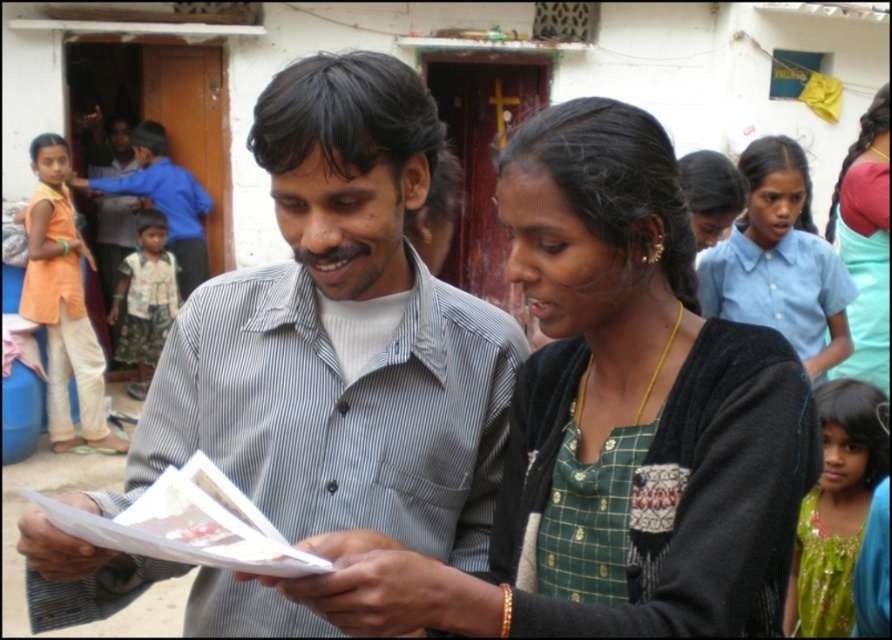
Question: Is striped cotton shirt at center smaller than teal fabric dress at upper right?

Choices:
 (A) yes
 (B) no

Answer: (A)

Question: Is green embroidered dress at lower right bigger than teal fabric dress at upper right?

Choices:
 (A) no
 (B) yes

Answer: (A)

Question: Which of these objects is positioned closest to the green embroidered dress at lower right?

Choices:
 (A) teal fabric dress at upper right
 (B) green woven apron at lower right

Answer: (B)

Question: Based on their relative distances, which object is farther from the teal fabric dress at upper right?

Choices:
 (A) light blue uniform at upper right
 (B) green textured dress at center

Answer: (B)

Question: Based on their relative distances, which object is nearer to the light blue uniform at upper right?

Choices:
 (A) orange cotton shirt at left
 (B) striped cotton shirt at center
 (C) green embroidered dress at lower right
 (D) teal fabric dress at upper right

Answer: (D)

Question: Is striped cotton shirt at center closer to camera compared to printed cotton shirt at left?

Choices:
 (A) no
 (B) yes

Answer: (B)